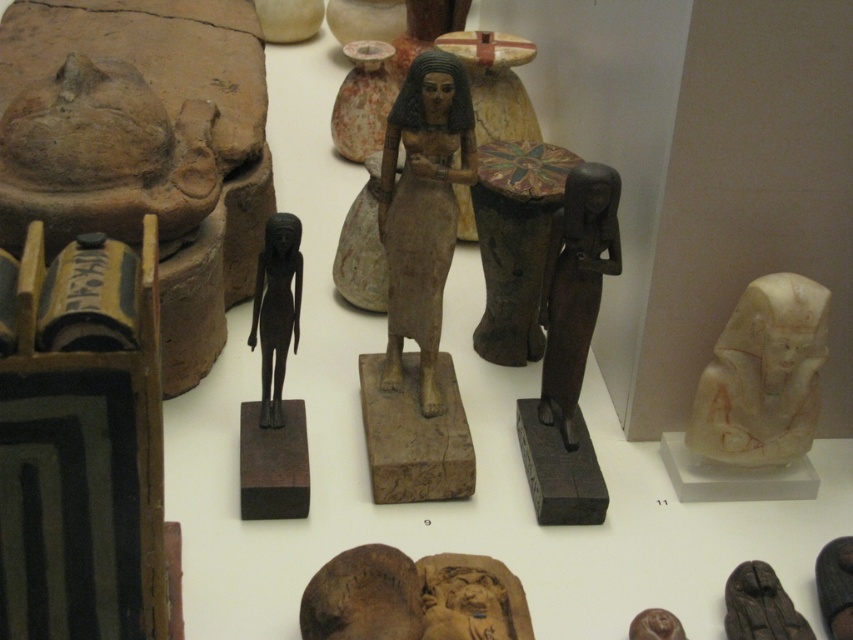
Question: Which point appears closest to the camera in this image?

Choices:
 (A) (390, 228)
 (B) (273, 349)
 (C) (751, 579)

Answer: (C)

Question: Can you confirm if matte brown statue at center is positioned to the right of white marble head at right?

Choices:
 (A) yes
 (B) no

Answer: (B)

Question: Based on their relative distances, which object is farther from the black polished statue at center-left?

Choices:
 (A) white marble head at right
 (B) black wood statue at lower right

Answer: (B)

Question: Does matte brown statue at center come in front of black polished statue at center-left?

Choices:
 (A) no
 (B) yes

Answer: (B)

Question: Estimate the real-world distances between objects in this image. Which object is closer to the matte brown statue at center?

Choices:
 (A) black polished statue at center-left
 (B) white marble head at right
 (C) black wood statue at lower right

Answer: (A)

Question: Observing the image, what is the correct spatial positioning of matte brown statue at center in reference to black polished statue at center-left?

Choices:
 (A) below
 (B) above

Answer: (B)